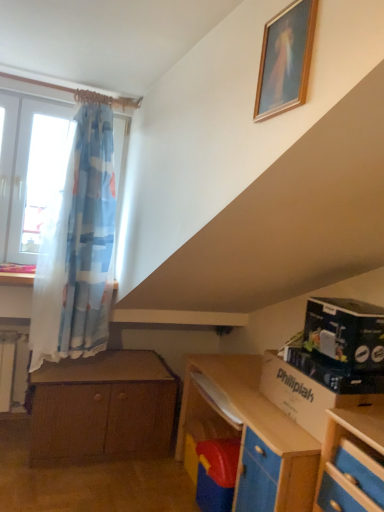
Measure the distance between point (352, 307) and camera.

They are 6.21 feet apart.

Image resolution: width=384 pixels, height=512 pixels. Find the location of `brown wooden chest of drawers at lower left`. brown wooden chest of drawers at lower left is located at coordinates (102, 408).

What do you see at coordinates (102, 408) in the screenshot? I see `brown wooden chest of drawers at lower left` at bounding box center [102, 408].

The height and width of the screenshot is (512, 384). What are the coordinates of `black cardboard box at right` in the screenshot? It's located at (345, 333).

Considering the relative sizes of cardboard box at lower right and brown wooden chest of drawers at lower left in the image provided, is cardboard box at lower right shorter than brown wooden chest of drawers at lower left?

Indeed, cardboard box at lower right has a lesser height compared to brown wooden chest of drawers at lower left.

Is point (293, 365) closer to viewer compared to point (126, 351)?

Yes, it is.

From the image's perspective, would you say cardboard box at lower right is positioned over brown wooden chest of drawers at lower left?

Correct, cardboard box at lower right appears higher than brown wooden chest of drawers at lower left in the image.

Can you confirm if cardboard box at lower right is bigger than brown wooden chest of drawers at lower left?

No, cardboard box at lower right is not bigger than brown wooden chest of drawers at lower left.

How distant is cardboard box at lower right from black cardboard box at right?

cardboard box at lower right is 6.62 inches away from black cardboard box at right.

Considering the points (305, 357) and (319, 337), which point is behind, point (305, 357) or point (319, 337)?

The point (319, 337) is behind.

Considering the positions of objects cardboard box at lower right and black cardboard box at right in the image provided, who is more to the right, cardboard box at lower right or black cardboard box at right?

black cardboard box at right is more to the right.

At what (x,y) coordinates should I click in order to perform the action: click on box that appears behind the cardboard box at lower right. Please return your answer as a coordinate pair (x, y). Looking at the image, I should click on (345, 333).

Which of these two, black cardboard box at right or brown wooden chest of drawers at lower left, stands shorter?

black cardboard box at right is shorter.

Consider the image. Is black cardboard box at right to the right of brown wooden chest of drawers at lower left from the viewer's perspective?

Correct, you'll find black cardboard box at right to the right of brown wooden chest of drawers at lower left.

Does point (373, 359) come in front of point (159, 394)?

That is True.

Does brown wooden chest of drawers at lower left come behind black cardboard box at right?

Yes.

Would you consider brown wooden chest of drawers at lower left to be distant from black cardboard box at right?

brown wooden chest of drawers at lower left is far away from black cardboard box at right.

From the image's perspective, which object appears higher, brown wooden chest of drawers at lower left or black cardboard box at right?

black cardboard box at right is shown above in the image.

Which of these two, brown wooden chest of drawers at lower left or black cardboard box at right, stands shorter?

black cardboard box at right.

Between black cardboard box at right and cardboard box at lower right, which one has smaller width?

cardboard box at lower right.

Is black cardboard box at right not near cardboard box at lower right?

No.

Is black cardboard box at right facing away from cardboard box at lower right?

No, black cardboard box at right is not facing away from cardboard box at lower right.

Does black cardboard box at right have a greater height compared to cardboard box at lower right?

Yes, black cardboard box at right is taller than cardboard box at lower right.

Considering the positions of objects wooden picture frame at upper center and cardboard box at lower right in the image provided, who is more to the left, wooden picture frame at upper center or cardboard box at lower right?

From the viewer's perspective, wooden picture frame at upper center appears more on the left side.

Is wooden picture frame at upper center touching cardboard box at lower right?

No, wooden picture frame at upper center is not touching cardboard box at lower right.

Between wooden picture frame at upper center and cardboard box at lower right, which one is positioned in front?

Positioned in front is wooden picture frame at upper center.

Considering the sizes of wooden picture frame at upper center and cardboard box at lower right in the image, is wooden picture frame at upper center wider or thinner than cardboard box at lower right?

Considering their sizes, wooden picture frame at upper center looks slimmer than cardboard box at lower right.

Is wooden picture frame at upper center wider or thinner than brown wooden chest of drawers at lower left?

wooden picture frame at upper center is thinner than brown wooden chest of drawers at lower left.

Is wooden picture frame at upper center shorter than brown wooden chest of drawers at lower left?

Yes.

Is point (284, 39) behind point (99, 432)?

No, it is in front of (99, 432).

The width and height of the screenshot is (384, 512). I want to click on cardboard box in front of the brown wooden chest of drawers at lower left, so click(x=314, y=388).

At what (x,y) coordinates should I click in order to perform the action: click on box positioned vertically above the cardboard box at lower right (from a real-world perspective). Please return your answer as a coordinate pair (x, y). Looking at the image, I should click on (345, 333).

Considering their positions, is cardboard box at lower right positioned closer to brown wooden chest of drawers at lower left than wooden picture frame at upper center?

cardboard box at lower right lies closer to brown wooden chest of drawers at lower left than the other object.

Consider the image. When comparing their distances from wooden picture frame at upper center, does brown wooden chest of drawers at lower left or black cardboard box at right seem closer?

black cardboard box at right is closer to wooden picture frame at upper center.

When comparing their distances from wooden picture frame at upper center, does cardboard box at lower right or brown wooden chest of drawers at lower left seem further?

The object further to wooden picture frame at upper center is brown wooden chest of drawers at lower left.

Based on the photo, estimate the real-world distances between objects in this image. Which object is further from black cardboard box at right, cardboard box at lower right or brown wooden chest of drawers at lower left?

brown wooden chest of drawers at lower left.

Based on their spatial positions, is brown wooden chest of drawers at lower left or wooden picture frame at upper center closer to black cardboard box at right?

wooden picture frame at upper center.

Estimate the real-world distances between objects in this image. Which object is closer to cardboard box at lower right, black cardboard box at right or brown wooden chest of drawers at lower left?

Among the two, black cardboard box at right is located nearer to cardboard box at lower right.

Considering their positions, is wooden picture frame at upper center positioned closer to cardboard box at lower right than brown wooden chest of drawers at lower left?

brown wooden chest of drawers at lower left is positioned closer to the anchor cardboard box at lower right.

From the image, which object appears to be nearer to cardboard box at lower right, brown wooden chest of drawers at lower left or black cardboard box at right?

Based on the image, black cardboard box at right appears to be nearer to cardboard box at lower right.

At what (x,y) coordinates should I click in order to perform the action: click on box between wooden picture frame at upper center and cardboard box at lower right in the up-down direction. Please return your answer as a coordinate pair (x, y). The image size is (384, 512). Looking at the image, I should click on (345, 333).

Find the location of a particular element. The image size is (384, 512). cardboard box located between brown wooden chest of drawers at lower left and black cardboard box at right in the left-right direction is located at coordinates (314, 388).

This screenshot has width=384, height=512. In order to click on box located between wooden picture frame at upper center and brown wooden chest of drawers at lower left in the depth direction in this screenshot , I will do `click(345, 333)`.

Locate an element on the screen. This screenshot has width=384, height=512. cardboard box between wooden picture frame at upper center and brown wooden chest of drawers at lower left in the up-down direction is located at coordinates (314, 388).